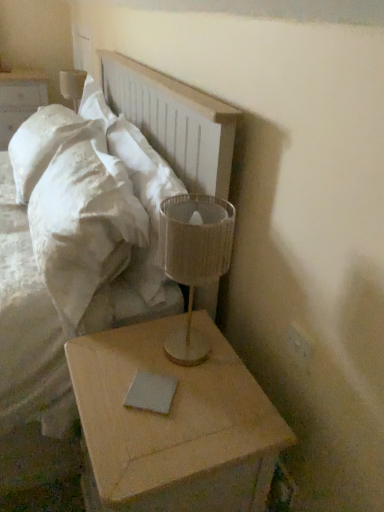
You are a GUI agent. You are given a task and a screenshot of the screen. Output one action in this format:
    pyautogui.click(x=<x>, y=<y>)
    Task: Click on the vacant space that is to the left of gray matte notepad at lower center
    
    Given the screenshot: What is the action you would take?
    pyautogui.click(x=105, y=378)